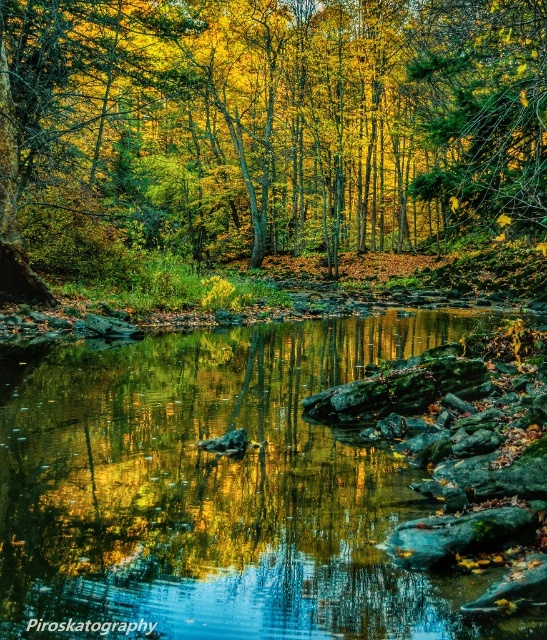
Which is more to the left, golden leafy tree at center or green mossy rocks at center?

Positioned to the left is green mossy rocks at center.

Is the position of golden leafy tree at center less distant than that of green mossy rocks at center?

No, it is behind green mossy rocks at center.

Is point (46, 156) positioned after point (202, 563)?

Yes, it is behind point (202, 563).

Image resolution: width=547 pixels, height=640 pixels. Identify the location of golden leafy tree at center. click(276, 120).